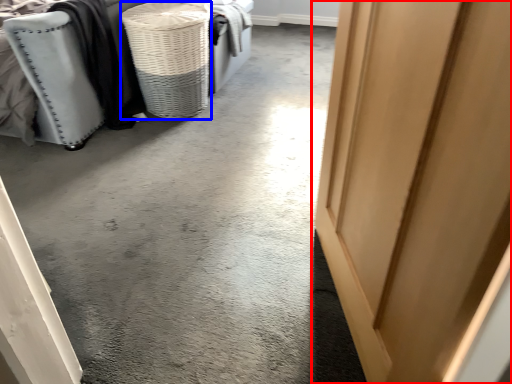
Question: Among these objects, which one is farthest to the camera, door (highlighted by a red box) or basket (highlighted by a blue box)?

Choices:
 (A) door
 (B) basket

Answer: (B)